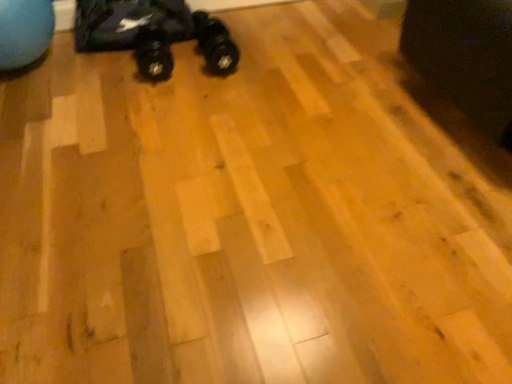
Question: In the image, is black rubber shoe at center on the left side or the right side of black fabric swivel chair at upper right?

Choices:
 (A) left
 (B) right

Answer: (A)

Question: Does point (208, 71) appear closer or farther from the camera than point (419, 24)?

Choices:
 (A) farther
 (B) closer

Answer: (A)

Question: Estimate the real-world distances between objects in this image. Which object is farther from the black rubber toy car at upper left?

Choices:
 (A) black fabric swivel chair at upper right
 (B) black rubber shoe at center

Answer: (A)

Question: Estimate the real-world distances between objects in this image. Which object is farther from the black rubber toy car at upper left?

Choices:
 (A) black fabric swivel chair at upper right
 (B) black rubber shoe at center

Answer: (A)